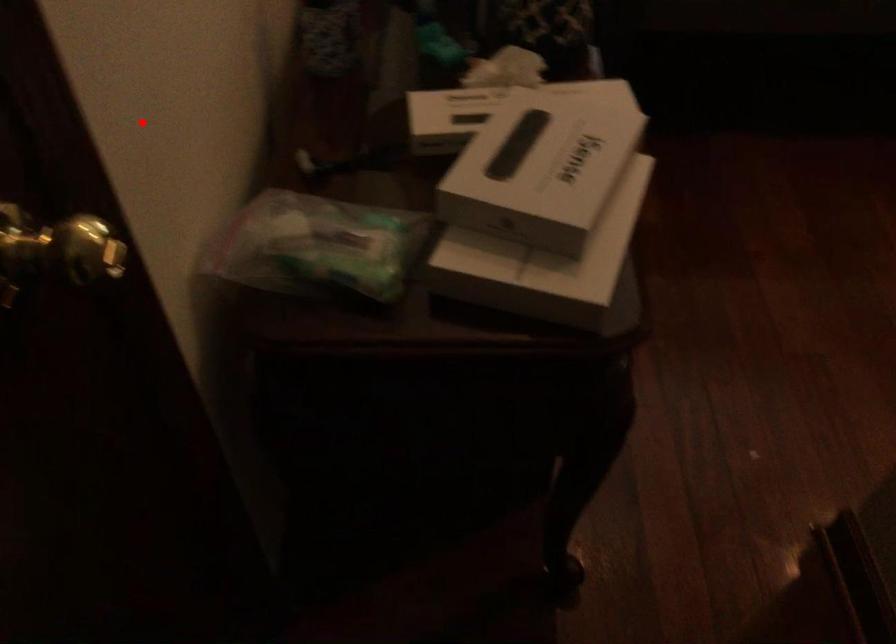
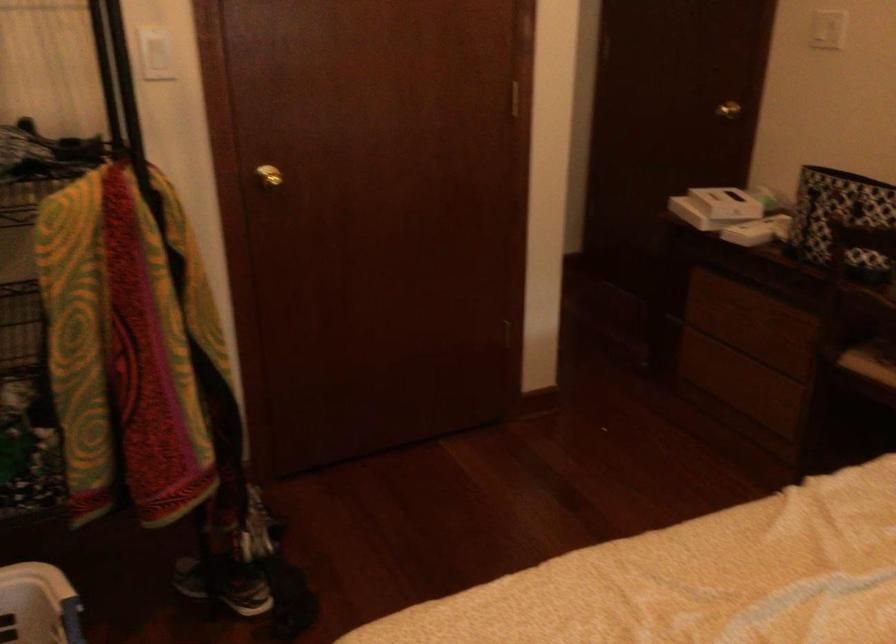
Question: A red point is marked in image1. In image2, is the corresponding 3D point closer to the camera or farther? Reply with the corresponding letter.

Choices:
 (A) The corresponding 3D point is closer.
 (B) The corresponding 3D point is farther.

Answer: (B)